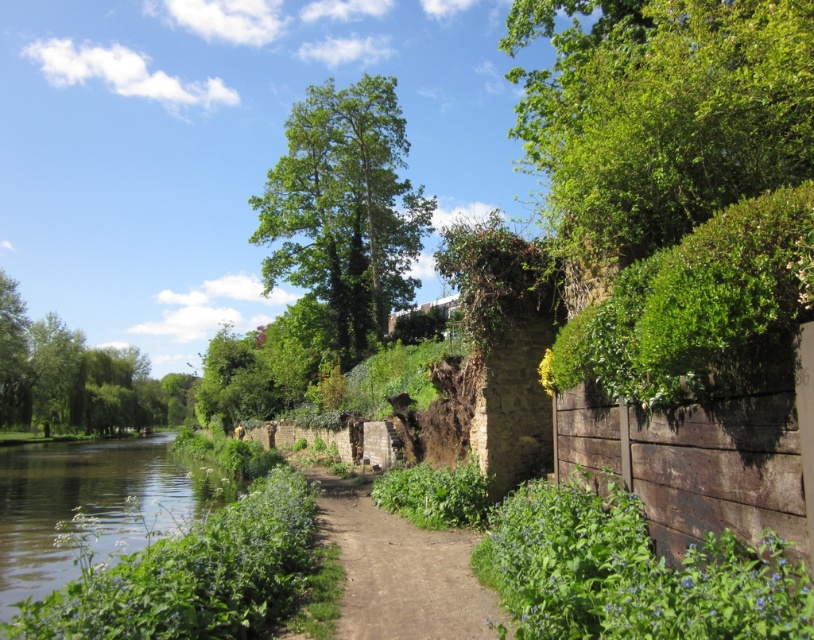
Looking at this image, you are standing at the starting point of the dirt path at center. If you walk straight ahead, will you eventually reach the stone wall behind the rustic wooden fence? Please explain your reasoning based on the scene description.

The dirt path at center winds through the scene, but the stone wall is located behind the rustic wooden fence on the right. Since the path is narrow and the scene description mentions it winds through the area, it is likely that the path does not lead directly to the stone wall but continues along the riverside. Therefore, walking straight ahead along the dirt path at center would not reach the stone wall behind the rustic wooden fence.

You are planning to plant a new tree in your garden. The space you have is just big enough for the green leafy tree at center. If you want to also add a small river feature similar to the green grassy river at lower left, will there be enough space?

The green leafy tree at center is larger in size than the green grassy river at lower left. Since the space is only enough for the tree, there might not be sufficient room for the river as well.

You are standing at the point marked by the coordinates point (344, 209) in the image. What is the closest object to you?

The point (344, 209) marks the green leafy tree at center, so the closest object to you is the green leafy tree at center.